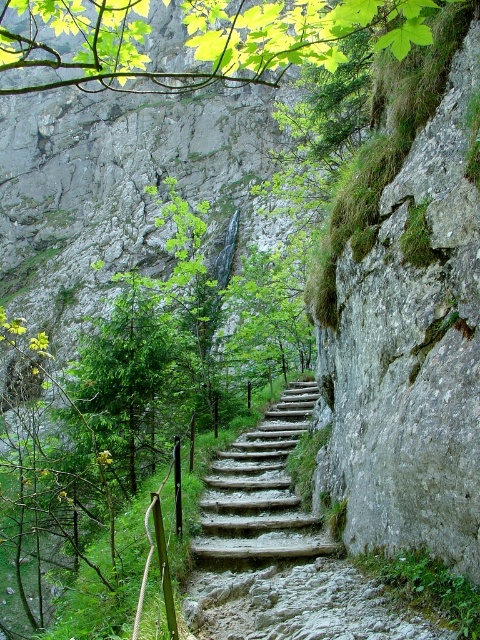
Question: Is rustic wooden stairs at center in front of green leafy branch at upper center?

Choices:
 (A) no
 (B) yes

Answer: (A)

Question: Can you confirm if green leafy branch at upper center is wider than wooden stairs at center?

Choices:
 (A) no
 (B) yes

Answer: (B)

Question: Can you confirm if green leafy branch at upper center is thinner than wooden stairs at center?

Choices:
 (A) yes
 (B) no

Answer: (B)

Question: Which point is farther from the camera taking this photo?

Choices:
 (A) pos(205,595)
 (B) pos(275,410)
 (C) pos(211,49)

Answer: (B)

Question: Considering the real-world distances, which object is closest to the wooden stairs at center?

Choices:
 (A) rustic wooden stairs at center
 (B) green leafy branch at upper center

Answer: (A)

Question: Which object is farther from the camera taking this photo?

Choices:
 (A) rustic wooden stairs at center
 (B) wooden stairs at center
 (C) green leafy branch at upper center

Answer: (B)